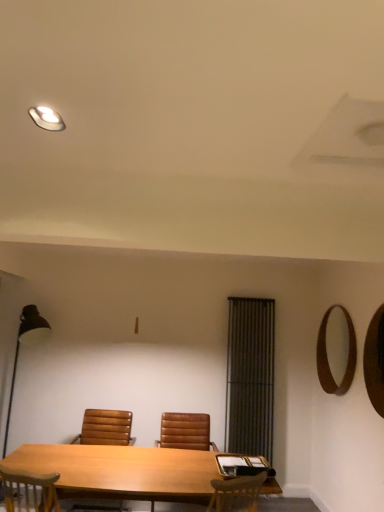
Question: Considering the relative sizes of brown leather chair at center, arranged as the second chair when viewed from the right, and brown wooden mirror at upper right, which is the first mirror from back to front, in the image provided, is brown leather chair at center, arranged as the second chair when viewed from the right, bigger than brown wooden mirror at upper right, which is the first mirror from back to front,?

Choices:
 (A) no
 (B) yes

Answer: (B)

Question: Is brown leather chair at center, arranged as the second chair when viewed from the right, at the left side of brown wooden mirror at upper right, which ranks as the second mirror in front-to-back order?

Choices:
 (A) no
 (B) yes

Answer: (B)

Question: Considering the relative positions of brown leather chair at center, arranged as the second chair when viewed from the right, and brown wooden mirror at upper right, which is the first mirror from back to front, in the image provided, is brown leather chair at center, arranged as the second chair when viewed from the right, behind brown wooden mirror at upper right, which is the first mirror from back to front,?

Choices:
 (A) no
 (B) yes

Answer: (A)

Question: Is brown leather chair at center, placed as the first chair when sorted from left to right, touching brown wooden mirror at upper right, which ranks as the second mirror in front-to-back order?

Choices:
 (A) no
 (B) yes

Answer: (A)

Question: Would you say brown leather chair at center, placed as the first chair when sorted from left to right, is outside brown wooden mirror at upper right, which is the first mirror from back to front?

Choices:
 (A) yes
 (B) no

Answer: (A)

Question: Would you consider brown leather chair at center, placed as the first chair when sorted from left to right, to be distant from brown wooden mirror at upper right, which ranks as the second mirror in front-to-back order?

Choices:
 (A) yes
 (B) no

Answer: (A)

Question: Considering the relative sizes of brown leather chair at center, placed as the first chair when sorted from left to right, and matte white light fixture at upper left in the image provided, is brown leather chair at center, placed as the first chair when sorted from left to right, bigger than matte white light fixture at upper left?

Choices:
 (A) no
 (B) yes

Answer: (B)

Question: Can you confirm if brown leather chair at center, arranged as the second chair when viewed from the right, is shorter than matte white light fixture at upper left?

Choices:
 (A) no
 (B) yes

Answer: (A)

Question: Is brown leather chair at center, placed as the first chair when sorted from left to right, touching matte white light fixture at upper left?

Choices:
 (A) yes
 (B) no

Answer: (B)

Question: Is matte white light fixture at upper left located within brown leather chair at center, arranged as the second chair when viewed from the right?

Choices:
 (A) yes
 (B) no

Answer: (B)

Question: From a real-world perspective, is brown leather chair at center, placed as the first chair when sorted from left to right, on top of matte white light fixture at upper left?

Choices:
 (A) no
 (B) yes

Answer: (A)

Question: Considering the relative sizes of brown leather chair at center, placed as the first chair when sorted from left to right, and matte white light fixture at upper left in the image provided, is brown leather chair at center, placed as the first chair when sorted from left to right, thinner than matte white light fixture at upper left?

Choices:
 (A) no
 (B) yes

Answer: (A)

Question: Is matte white light fixture at upper left beside wooden mirror at right, the second mirror from the back?

Choices:
 (A) yes
 (B) no

Answer: (B)